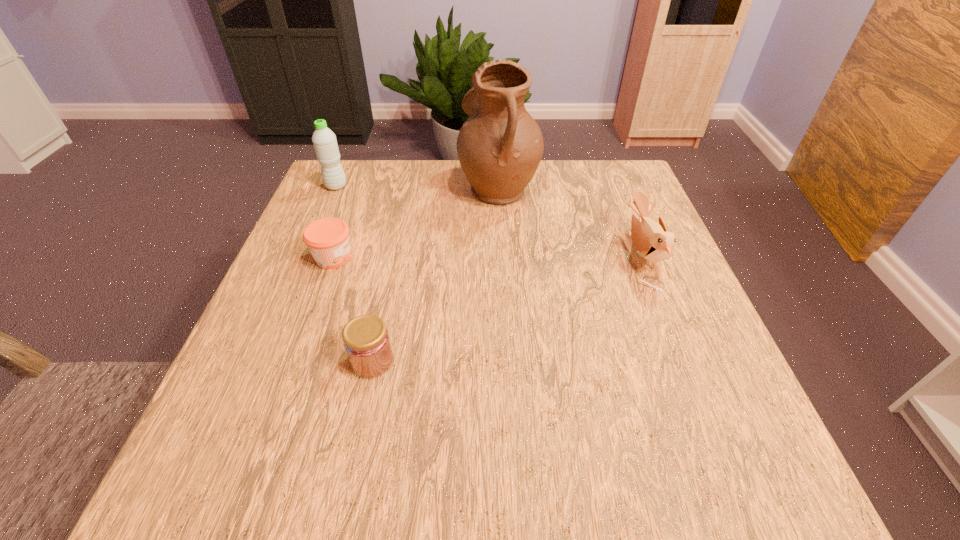
The width and height of the screenshot is (960, 540). Identify the location of free location located at the spout of the pitcher. point(362,186).

Find the location of `free location located 0.240m on the front of the water bottle`. free location located 0.240m on the front of the water bottle is located at coordinates (307, 254).

I want to click on vacant space located 0.190m at the beak of the third tallest object, so click(x=537, y=256).

The width and height of the screenshot is (960, 540). I want to click on blank space located 0.210m at the beak of the third tallest object, so click(x=528, y=256).

In order to click on free space located at the beak of the third tallest object in this screenshot , I will do `click(467, 256)`.

Where is `vacant space located 0.160m on the back of the right jam`? This screenshot has width=960, height=540. vacant space located 0.160m on the back of the right jam is located at coordinates (390, 280).

Locate an element on the screen. The height and width of the screenshot is (540, 960). free region located on the front label of the left jam is located at coordinates (472, 258).

The width and height of the screenshot is (960, 540). I want to click on pitcher that is at the far edge, so click(x=500, y=146).

Where is `water bottle that is at the far edge`? This screenshot has width=960, height=540. water bottle that is at the far edge is located at coordinates (324, 140).

The image size is (960, 540). In order to click on water bottle that is at the left edge in this screenshot , I will do `click(324, 140)`.